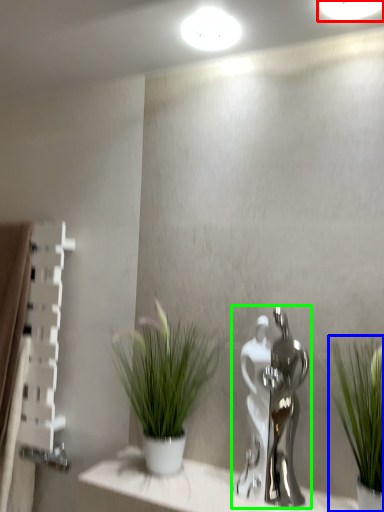
Question: Based on their relative distances, which object is farther from lighting (highlighted by a red box)? Choose from houseplant (highlighted by a blue box) and tap (highlighted by a green box).

Choices:
 (A) houseplant
 (B) tap

Answer: (B)